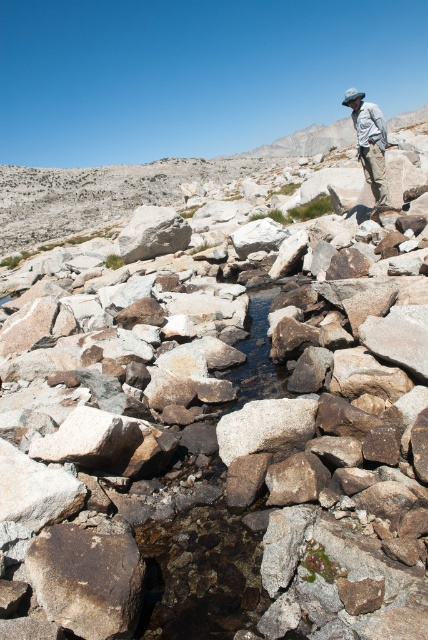
You are a hiker who has lost your hat. You see the gray granite boulder at center and the light brown fabric hat at upper right. Which object is located to the right of the other?

The light brown fabric hat at upper right is located to the right of the gray granite boulder at center.

You are a hiker standing at the edge of the rocky landscape. You see the gray granite boulder at center and the light brown fabric hat at upper right. Which object is closer to you?

The gray granite boulder at center is closer to you because it is further to the viewer than the light brown fabric hat at upper right.

You are standing at the origin point of the coordinate system in the image. You want to place a GPS marker at the location of the brown rough rock at center. What are the coordinates where you should place the GPS marker?

The coordinates for the brown rough rock at center are at point (86, 579).